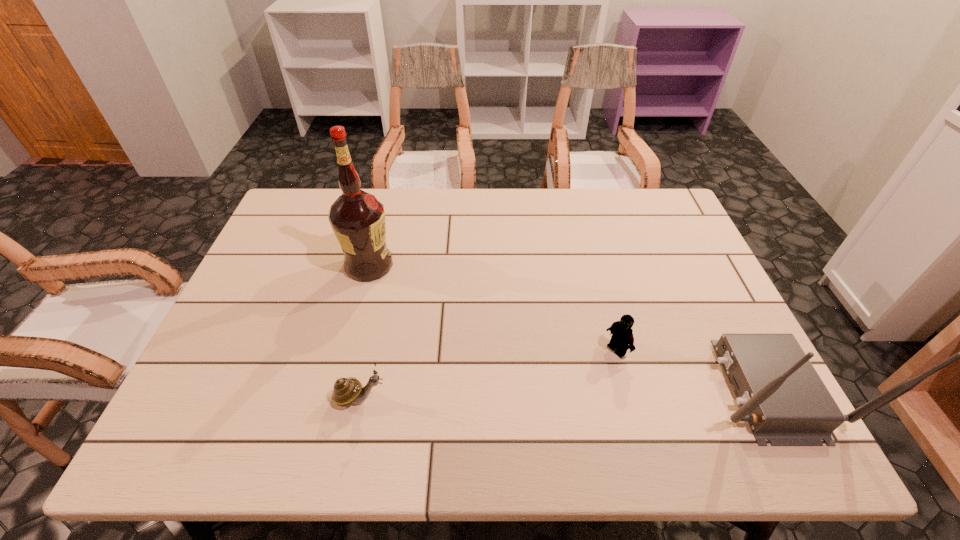
Where is `vacant space that satisfies the following two spatial constraints: 1. on the front side of the router; 2. on the back of the second object from right to left to connect cables`? This screenshot has height=540, width=960. vacant space that satisfies the following two spatial constraints: 1. on the front side of the router; 2. on the back of the second object from right to left to connect cables is located at coordinates (628, 388).

The width and height of the screenshot is (960, 540). I want to click on vacant area in the image that satisfies the following two spatial constraints: 1. on the front side of the router; 2. on the back of the Lego to connect cables, so click(628, 388).